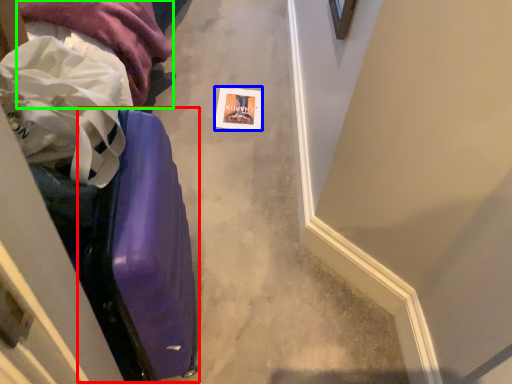
Question: Which object is the closest to the luggage (highlighted by a red box)? Choose among these: postcard (highlighted by a blue box) or clothing (highlighted by a green box).

Choices:
 (A) postcard
 (B) clothing

Answer: (B)